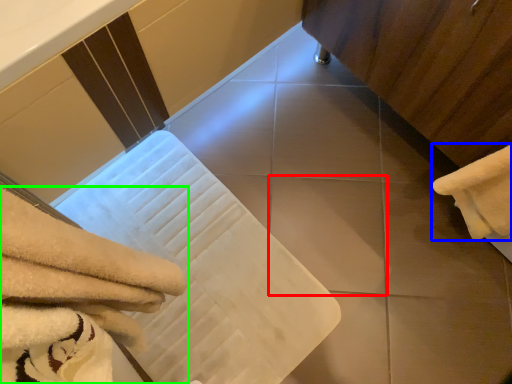
Question: Estimate the real-world distances between objects in this image. Which object is farther from tile (highlighted by a red box), towel (highlighted by a blue box) or towel (highlighted by a green box)?

Choices:
 (A) towel
 (B) towel

Answer: (B)